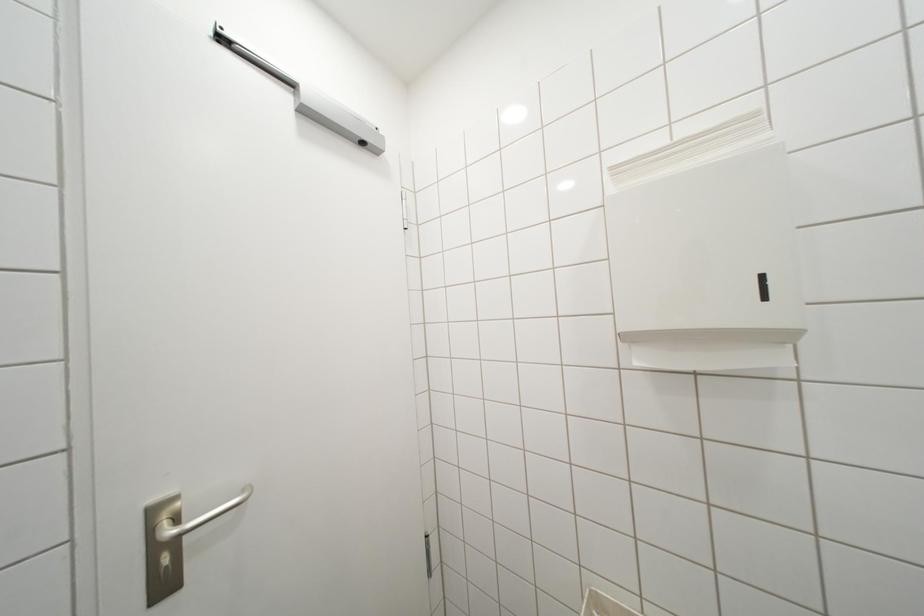
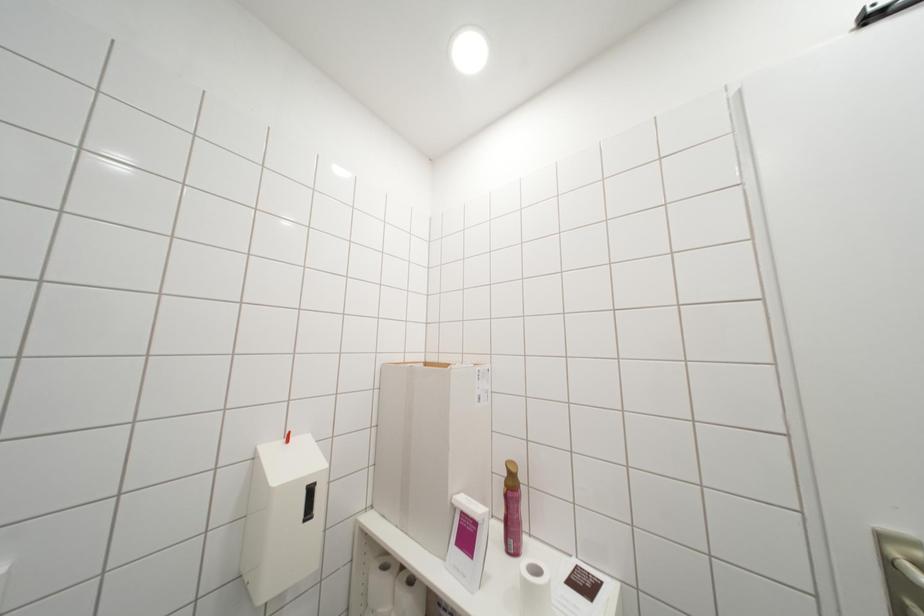
Question: How did the camera likely rotate?

Choices:
 (A) Left
 (B) Right
 (C) Up
 (D) Down

Answer: (A)